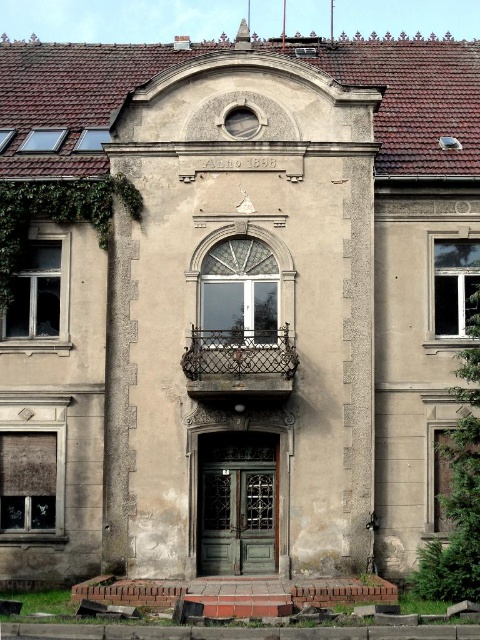
Question: Which of the following is the closest to the observer?

Choices:
 (A) rusty metal balcony at center
 (B) green leafy ivy at left

Answer: (A)

Question: Is green leafy ivy at left thinner than rusty metal balcony at center?

Choices:
 (A) yes
 (B) no

Answer: (A)

Question: Which of the following is the closest to the observer?

Choices:
 (A) (19, 252)
 (B) (457, 372)
 (C) (272, 369)

Answer: (C)

Question: From the image, what is the correct spatial relationship of green leafy ivy at left in relation to rusty metal balcony at center?

Choices:
 (A) right
 (B) left

Answer: (B)

Question: Can you confirm if green ivy at right is thinner than rusty metal balcony at center?

Choices:
 (A) no
 (B) yes

Answer: (B)

Question: Among these objects, which one is farthest from the camera?

Choices:
 (A) green ivy at right
 (B) rusty metal balcony at center

Answer: (B)